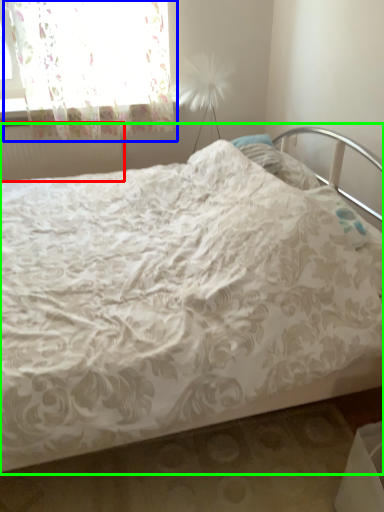
Question: Which object is positioned farthest from radiator (highlighted by a red box)? Select from curtain (highlighted by a blue box) and bed (highlighted by a green box).

Choices:
 (A) curtain
 (B) bed

Answer: (B)